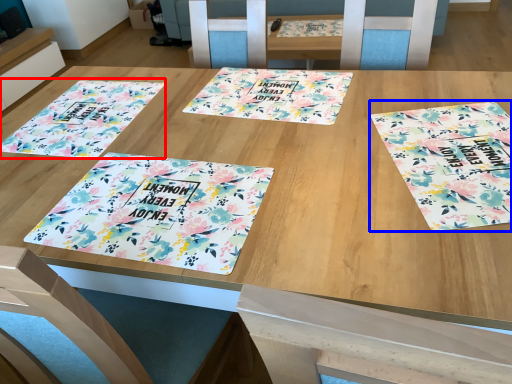
Question: Which object is closer to the camera taking this photo, tablecloth (highlighted by a red box) or tablecloth (highlighted by a blue box)?

Choices:
 (A) tablecloth
 (B) tablecloth

Answer: (B)